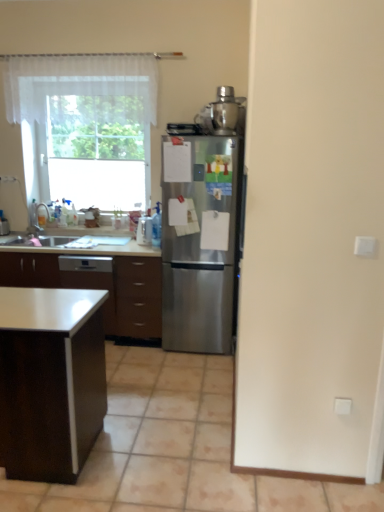
Question: From a real-world perspective, is white glossy table at lower left above or below stainless steel refrigerator at center?

Choices:
 (A) below
 (B) above

Answer: (A)

Question: From the image's perspective, is white glossy table at lower left above or below stainless steel refrigerator at center?

Choices:
 (A) below
 (B) above

Answer: (A)

Question: Which is farther from the white glossy table at lower left?

Choices:
 (A) clear plastic spray bottle at center, which ranks as the 2th appliance in right-to-left order
 (B) satin silver blender at upper right, positioned as the first appliance in top-to-bottom order
 (C) white plastic electric outlet at lower right
 (D) satin white dishwasher at lower left
 (E) white sheer curtain at upper left

Answer: (E)

Question: Which object is the closest to the satin silver blender at upper right, the 2th appliance from the left?

Choices:
 (A) stainless steel refrigerator at center
 (B) brushed metal faucet at left
 (C) satin white dishwasher at lower left
 (D) brown wood drawer at center
 (E) white glossy table at lower left

Answer: (A)